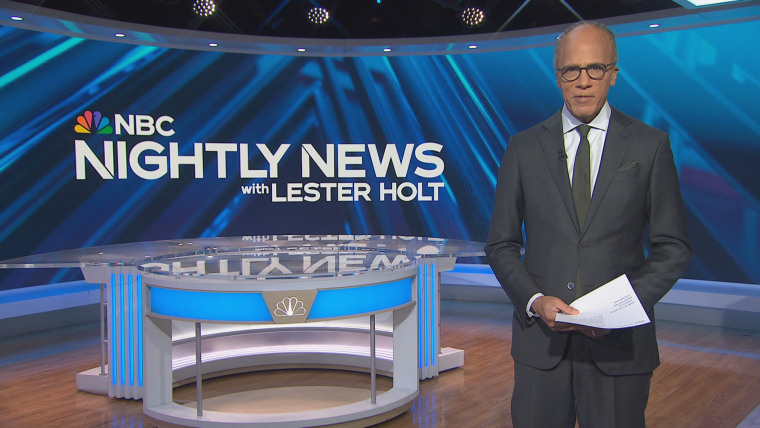
The width and height of the screenshot is (760, 428). I want to click on floor, so click(x=58, y=396).